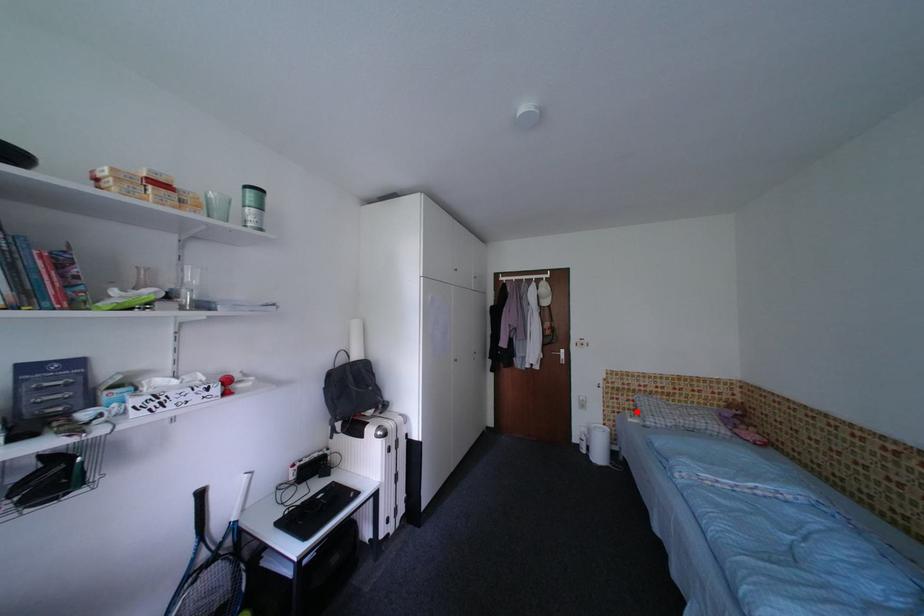
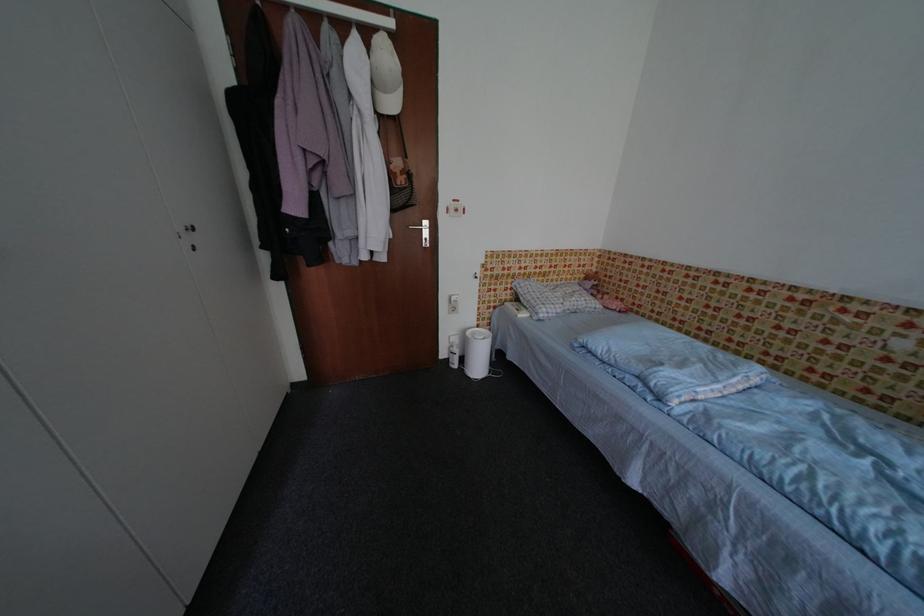
Question: A red point is marked in image1. In image2, is the corresponding 3D point closer to the camera or farther? Reply with the corresponding letter.

Choices:
 (A) The corresponding 3D point is closer.
 (B) The corresponding 3D point is farther.

Answer: (A)